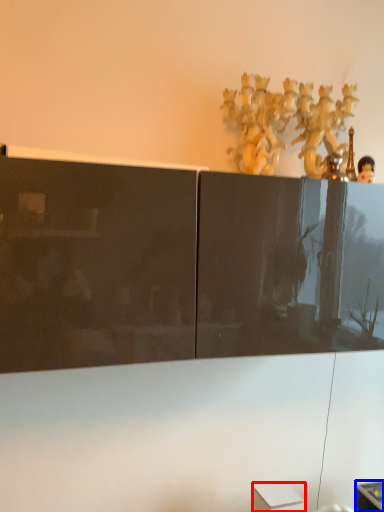
Question: Which of the following is the farthest to the observer, cabinetry (highlighted by a red box) or furniture (highlighted by a blue box)?

Choices:
 (A) cabinetry
 (B) furniture

Answer: (B)